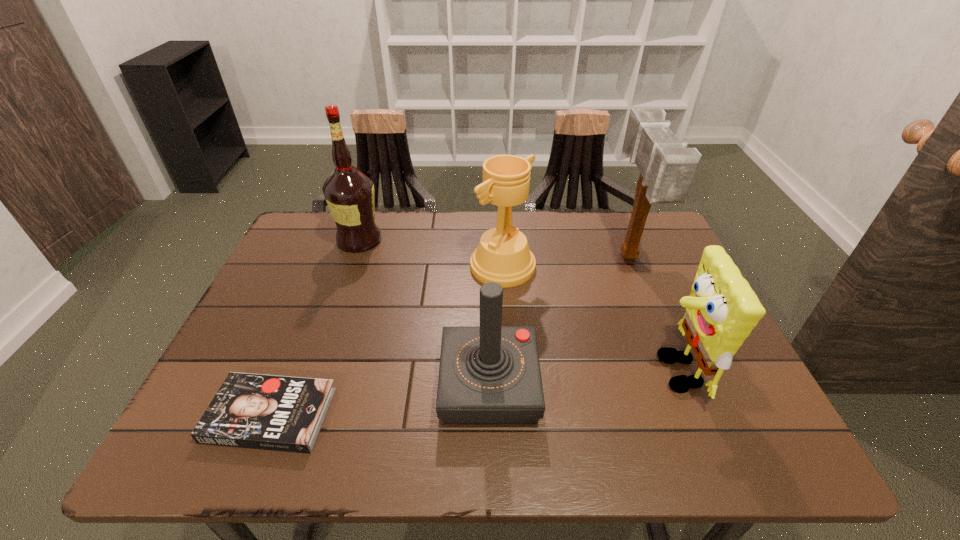
At what (x,y) coordinates should I click in order to perform the action: click on object that stands as the fourth closest to the alcohol. Please return your answer as a coordinate pair (x, y). The image size is (960, 540). Looking at the image, I should click on (667, 167).

Image resolution: width=960 pixels, height=540 pixels. I want to click on free spot that satisfies the following two spatial constraints: 1. on the rectangular base of the joystick; 2. on the front side of the book, so click(x=490, y=415).

The width and height of the screenshot is (960, 540). I want to click on vacant space that satisfies the following two spatial constraints: 1. on the back side of the mallet; 2. on the left side of the shortest object, so click(x=333, y=258).

At what (x,y) coordinates should I click in order to perform the action: click on free space that satisfies the following two spatial constraints: 1. on the label of the alcohol; 2. on the left side of the mallet. Please return your answer as a coordinate pair (x, y). The image size is (960, 540). Looking at the image, I should click on (353, 258).

Where is `vacant area in the image that satisfies the following two spatial constraints: 1. on the label of the alcohol; 2. on the left side of the award`? This screenshot has width=960, height=540. vacant area in the image that satisfies the following two spatial constraints: 1. on the label of the alcohol; 2. on the left side of the award is located at coordinates (350, 266).